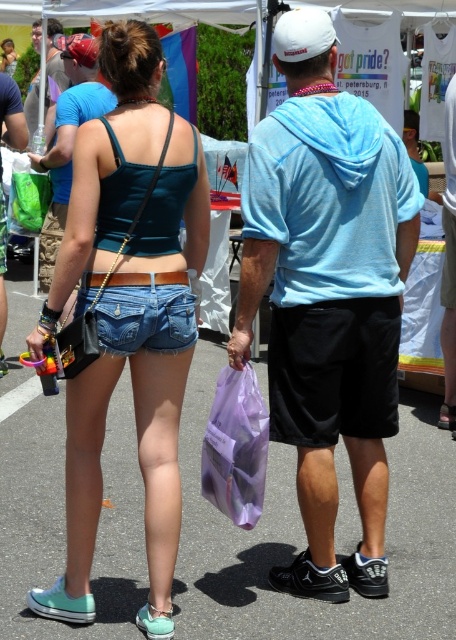
Question: Does purple plastic bag at lower center have a lesser width compared to matte blue hoodie at upper center?

Choices:
 (A) no
 (B) yes

Answer: (B)

Question: From the image, what is the correct spatial relationship of purple plastic bag at lower center in relation to denim shorts at lower center?

Choices:
 (A) right
 (B) left

Answer: (A)

Question: Which of the following is the closest to the observer?

Choices:
 (A) denim shorts at lower center
 (B) matte blue hoodie at upper center
 (C) matte blue hoodie at center

Answer: (A)

Question: In this image, where is denim shorts at center located relative to matte blue hoodie at upper center?

Choices:
 (A) above
 (B) below

Answer: (B)

Question: Which point is farther from the camera taking this photo?

Choices:
 (A) (99, 330)
 (B) (46, 122)

Answer: (B)

Question: Which point is farther to the camera?

Choices:
 (A) (83, 308)
 (B) (52, 58)
 (C) (242, 468)
 (D) (310, 374)

Answer: (B)